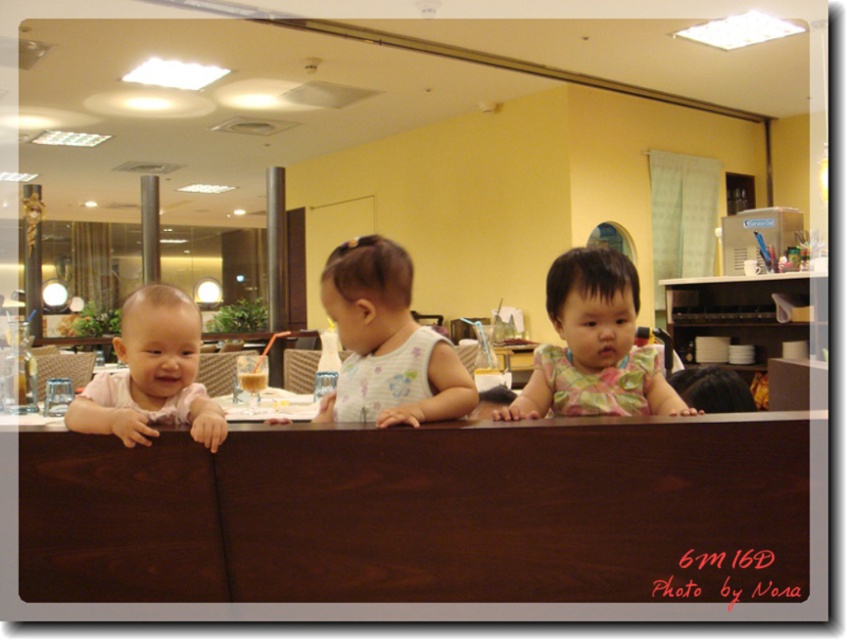
You are a customer in this restaurant and want to sit at the dark wood table at center. From your current position near the matte pink shirt at left, which direction should you move to reach it?

The dark wood table at center is to the right of the matte pink shirt at left, so you should move to your right to reach it.

You are a parent trying to seat your children at a restaurant table. The table has a width of 1 meter. You have two children wearing the floral fabric dress at center and the matte pink shirt at left. Which child can you seat on the left side of the table without their clothing extending beyond the table edges?

The matte pink shirt at left has a smaller width than the floral fabric dress at center. Since the table is 1 meter wide, the child wearing the matte pink shirt at left can be seated on the left side without their clothing extending beyond the table edges, as their shirt is narrower.

You are a parent trying to reach your child who is at the counter. You are standing near the entrance, which is 2 meters away from the white floral tank top at center. Can you reach your child without moving closer?

The distance between you and the white floral tank top at center is 2 meters, so you cannot reach your child without moving closer.